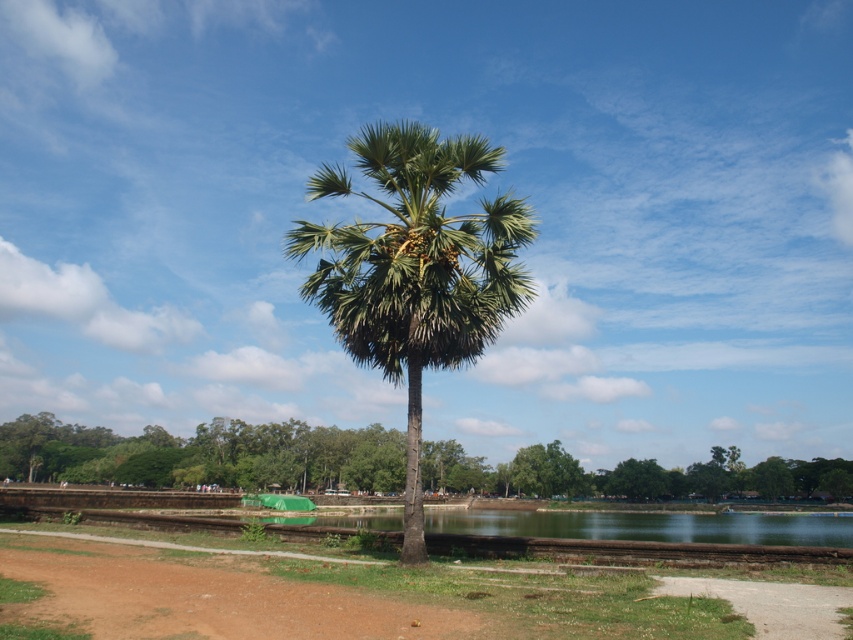
You are a landscape architect planning to install a new bench between the green leafy palm tree at center and the green leafy tree at center. The bench requires a minimum of 100 feet of space between the two trees to be placed safely. Can the bench be installed in this location?

The green leafy palm tree at center and green leafy tree at center are 150.91 feet apart from each other. Since the required minimum space is 100 feet, the bench can be installed between them as the distance meets the requirement.